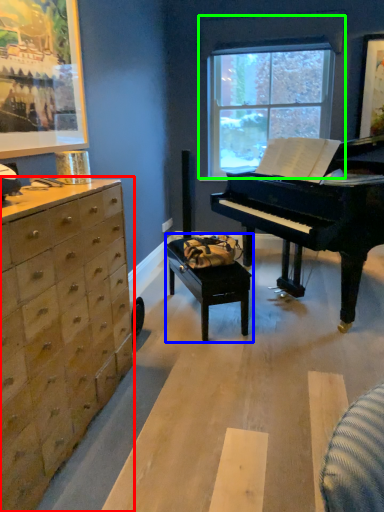
Question: Which object is positioned closest to chest of drawers (highlighted by a red box)? Select from table (highlighted by a blue box) and window (highlighted by a green box).

Choices:
 (A) table
 (B) window

Answer: (A)